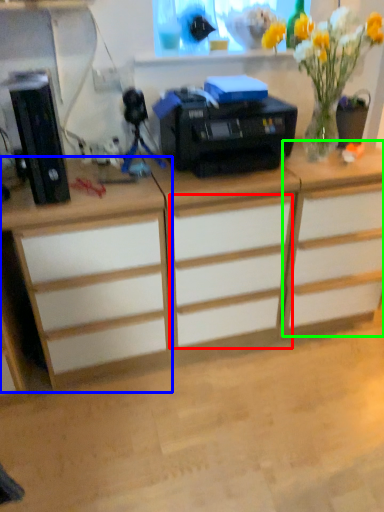
Question: Which object is positioned closest to drawer (highlighted by a red box)? Select from desk (highlighted by a blue box) and cabinetry (highlighted by a green box).

Choices:
 (A) desk
 (B) cabinetry

Answer: (B)